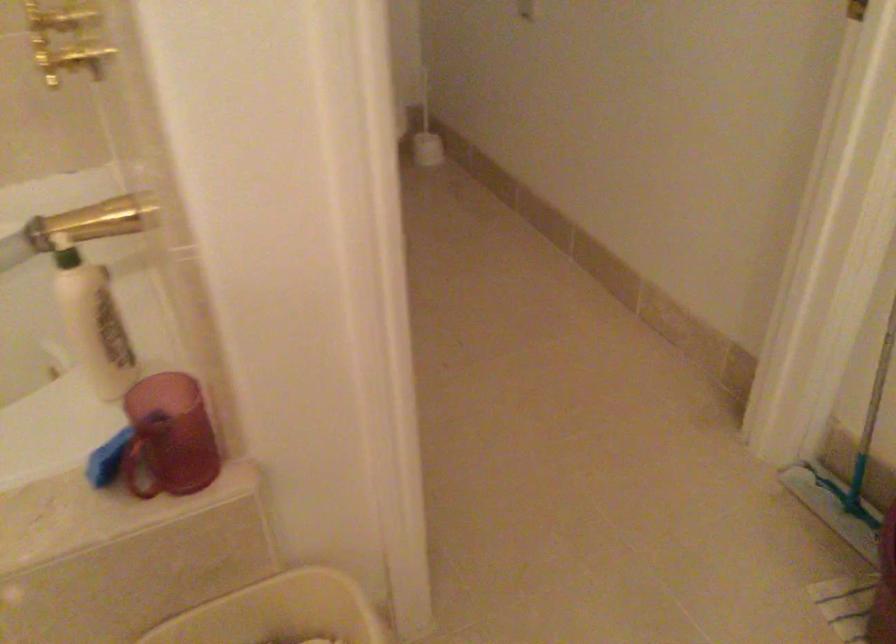
The width and height of the screenshot is (896, 644). What do you see at coordinates (423, 105) in the screenshot?
I see `the toilet brush handle` at bounding box center [423, 105].